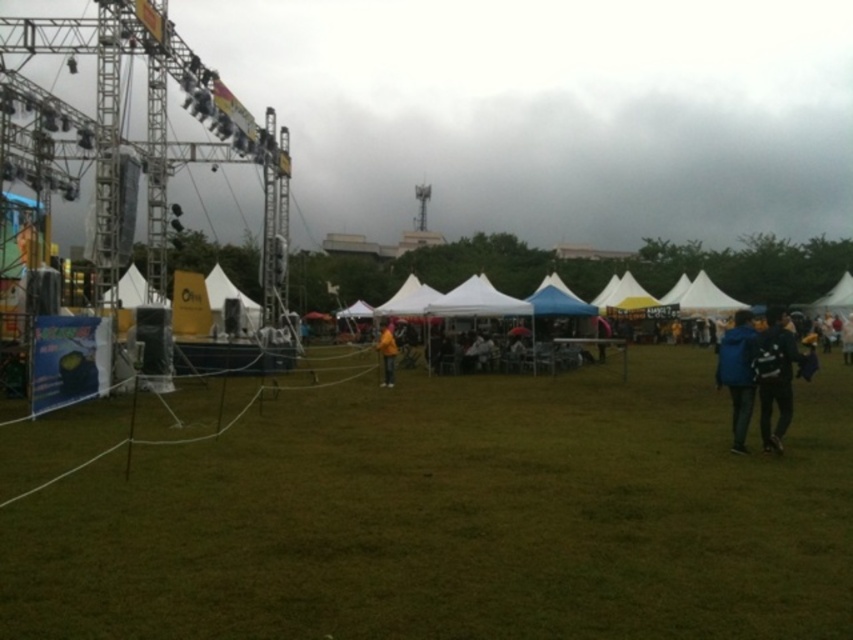
Question: Which point is farther to the camera?

Choices:
 (A) blue fabric jacket at right
 (B) light blue fabric tent at center

Answer: (B)

Question: Which object appears closest to the camera in this image?

Choices:
 (A) blue fabric backpack at right
 (B) yellow matte jacket at center
 (C) green grass at center

Answer: (C)

Question: Is blue fabric jacket at right positioned before light blue fabric tent at center?

Choices:
 (A) no
 (B) yes

Answer: (B)

Question: Which of the following is the closest to the observer?

Choices:
 (A) green grass at center
 (B) yellow matte jacket at center

Answer: (A)

Question: From the image, what is the correct spatial relationship of green grass at center in relation to light blue fabric tent at center?

Choices:
 (A) below
 (B) above

Answer: (A)

Question: Can you confirm if green grass at center is thinner than light blue fabric tent at center?

Choices:
 (A) yes
 (B) no

Answer: (B)